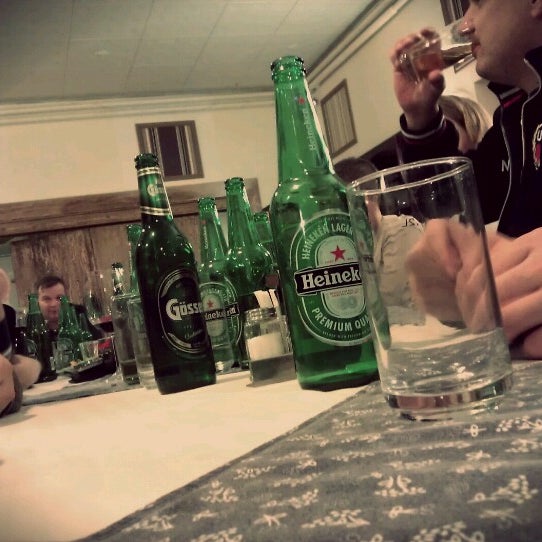
This screenshot has width=542, height=542. What are the coordinates of `bottle` in the screenshot? It's located at (291, 138), (243, 203), (214, 238), (157, 210), (130, 231), (121, 276).